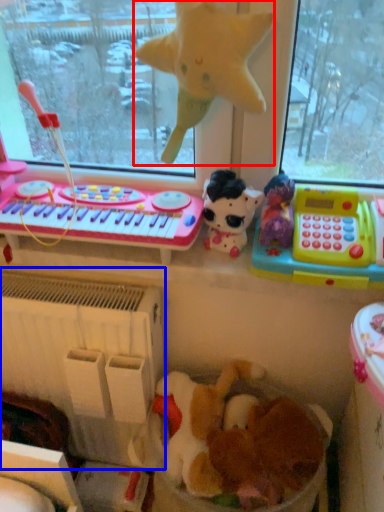
Question: Which object appears farthest to the camera in this image, toy (highlighted by a red box) or radiator (highlighted by a blue box)?

Choices:
 (A) toy
 (B) radiator

Answer: (B)